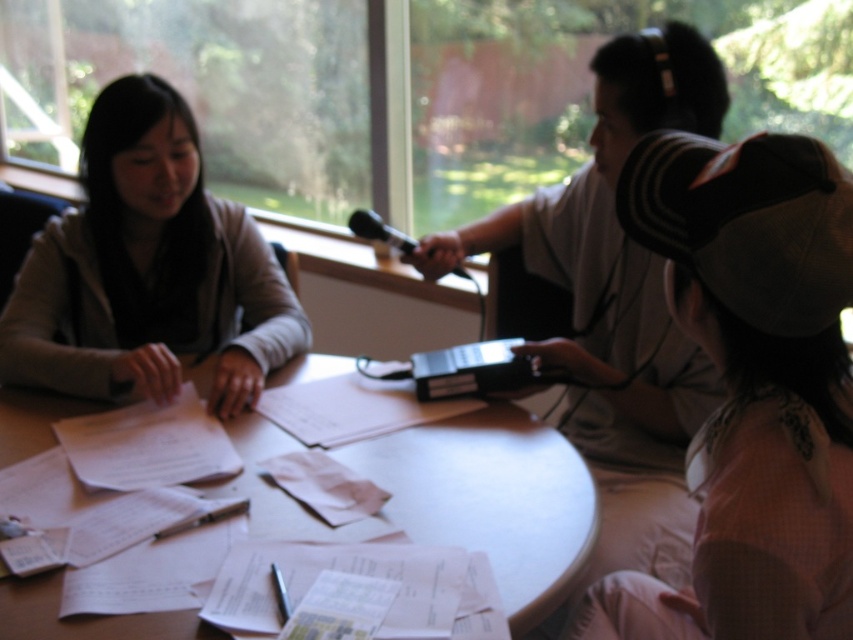
You are a researcher preparing to record an interview. You have a microphone that needs to be placed 6 inches away from the white paper at center to avoid background noise. Can you position the microphone correctly using the white wooden table at center as a reference?

The distance between the white wooden table at center and the white paper at center is 6.10 inches. Since the required distance is 6 inches, positioning the microphone just slightly closer to the white paper at center than the table would meet the requirement.

You are organizing a meeting and need to place a 12x12 inch square placemat on the white wooden table at center. Given that the white paper at center is already placed on the table, can the placemat fit on the table without overlapping the paper?

The white wooden table at center is wider than the white paper at center, so the placemat can fit on the table without overlapping the paper as long as it is placed in an area not occupied by the paper.